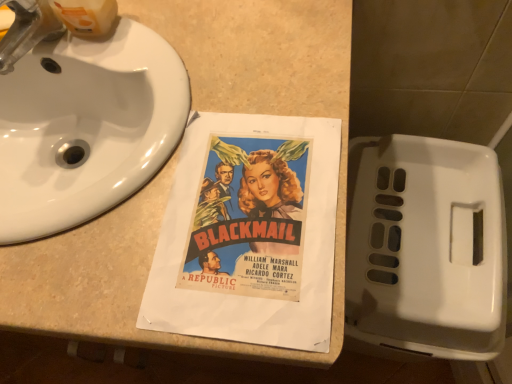
Question: Considering the relative sizes of brushed metal faucet at upper left and white glossy sink at upper left in the image provided, is brushed metal faucet at upper left smaller than white glossy sink at upper left?

Choices:
 (A) yes
 (B) no

Answer: (A)

Question: From a real-world perspective, is brushed metal faucet at upper left below white glossy sink at upper left?

Choices:
 (A) yes
 (B) no

Answer: (B)

Question: From the image's perspective, is brushed metal faucet at upper left located above white glossy sink at upper left?

Choices:
 (A) yes
 (B) no

Answer: (A)

Question: Can you confirm if brushed metal faucet at upper left is wider than white glossy sink at upper left?

Choices:
 (A) yes
 (B) no

Answer: (B)

Question: Is white glossy sink at upper left at the back of brushed metal faucet at upper left?

Choices:
 (A) no
 (B) yes

Answer: (A)

Question: Considering the relative sizes of brushed metal faucet at upper left and white glossy sink at upper left in the image provided, is brushed metal faucet at upper left taller than white glossy sink at upper left?

Choices:
 (A) no
 (B) yes

Answer: (A)

Question: Is brushed metal faucet at upper left directly adjacent to white plastic toilet at lower right?

Choices:
 (A) no
 (B) yes

Answer: (A)

Question: Is the depth of brushed metal faucet at upper left less than that of white plastic toilet at lower right?

Choices:
 (A) no
 (B) yes

Answer: (B)

Question: Is brushed metal faucet at upper left wider than white plastic toilet at lower right?

Choices:
 (A) no
 (B) yes

Answer: (A)

Question: From a real-world perspective, is brushed metal faucet at upper left below white plastic toilet at lower right?

Choices:
 (A) yes
 (B) no

Answer: (B)

Question: Considering the relative sizes of brushed metal faucet at upper left and white plastic toilet at lower right in the image provided, is brushed metal faucet at upper left smaller than white plastic toilet at lower right?

Choices:
 (A) no
 (B) yes

Answer: (B)

Question: Is brushed metal faucet at upper left oriented towards white plastic toilet at lower right?

Choices:
 (A) no
 (B) yes

Answer: (A)

Question: From a real-world perspective, is beige laminate counter at center on brushed metal faucet at upper left?

Choices:
 (A) no
 (B) yes

Answer: (A)